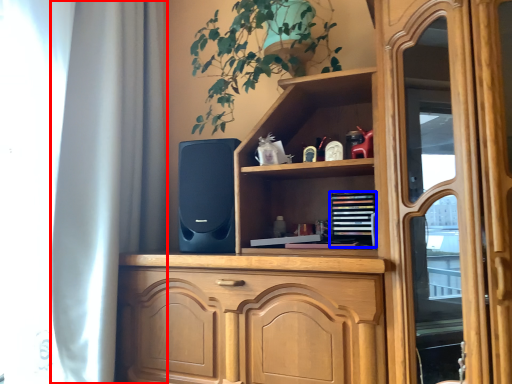
Question: Among these objects, which one is farthest to the camera, curtain (highlighted by a red box) or book (highlighted by a blue box)?

Choices:
 (A) curtain
 (B) book

Answer: (B)